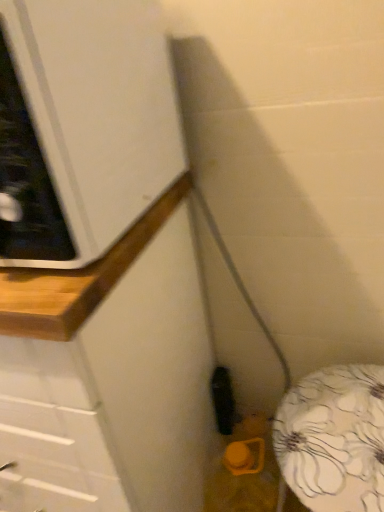
Question: Would you say white glossy cabinet at upper left is a long distance from wooden counter at lower left?

Choices:
 (A) yes
 (B) no

Answer: (B)

Question: From the image's perspective, is white glossy cabinet at upper left on top of wooden counter at lower left?

Choices:
 (A) yes
 (B) no

Answer: (A)

Question: Is white glossy cabinet at upper left to the right of wooden counter at lower left from the viewer's perspective?

Choices:
 (A) yes
 (B) no

Answer: (B)

Question: From a real-world perspective, is white glossy cabinet at upper left physically above wooden counter at lower left?

Choices:
 (A) no
 (B) yes

Answer: (B)

Question: Is white glossy cabinet at upper left taller than wooden counter at lower left?

Choices:
 (A) yes
 (B) no

Answer: (B)

Question: From the image's perspective, is white glossy cabinet at upper left located beneath wooden counter at lower left?

Choices:
 (A) yes
 (B) no

Answer: (B)

Question: Can you confirm if wooden counter at lower left is bigger than white glossy cabinet at upper left?

Choices:
 (A) yes
 (B) no

Answer: (A)

Question: From a real-world perspective, is wooden counter at lower left located beneath white glossy cabinet at upper left?

Choices:
 (A) yes
 (B) no

Answer: (A)

Question: From the image's perspective, would you say wooden counter at lower left is positioned over white glossy cabinet at upper left?

Choices:
 (A) no
 (B) yes

Answer: (A)

Question: Can you confirm if wooden counter at lower left is taller than white glossy cabinet at upper left?

Choices:
 (A) yes
 (B) no

Answer: (A)

Question: Are wooden counter at lower left and white glossy cabinet at upper left far apart?

Choices:
 (A) no
 (B) yes

Answer: (A)

Question: Is white glossy cabinet at upper left a part of wooden counter at lower left?

Choices:
 (A) no
 (B) yes

Answer: (A)

Question: Is white glossy cabinet at upper left wider or thinner than wooden counter at lower left?

Choices:
 (A) thin
 (B) wide

Answer: (A)